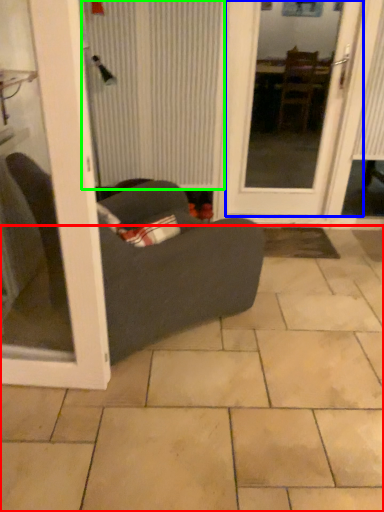
Question: Which object is positioned farthest from ceramic tile (highlighted by a red box)? Select from door (highlighted by a blue box) and curtain (highlighted by a green box).

Choices:
 (A) door
 (B) curtain

Answer: (A)